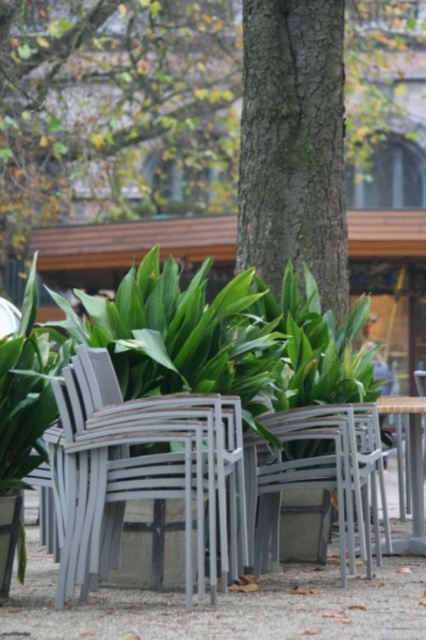
You are a delivery person trying to navigate through the outdoor seating area. You need to place a package between the green rough bark tree at center and the metallic gray chair at center. Can you fit the package in the space between them if the package is 10 meters long?

The distance between the green rough bark tree at center and the metallic gray chair at center is 11.39 meters. Since the package is 10 meters long, it can fit in the space between them as there is enough room.

Looking at this image, you are a painter standing at the edge of the outdoor seating area. You want to paint the smooth bark tree trunk at center and the metallic silver chair at center. Since you can only focus on one subject at a time, which one is closer to you? Please answer based on their distance from your current position.

Both the smooth bark tree trunk at center and the metallic silver chair at center are at the same distance from you since they are both at the center of the image.

You are a painter setting up your easel to paint the scene. You want to focus on the green rough bark tree at center and the metallic gray chair at center. Which object should you place in the background to emphasize the size difference between them?

You should place the metallic gray chair at center in the foreground and the green rough bark tree at center in the background because the green rough bark tree at center is bigger than the metallic gray chair at center, making the size difference more noticeable when the smaller object is closer.